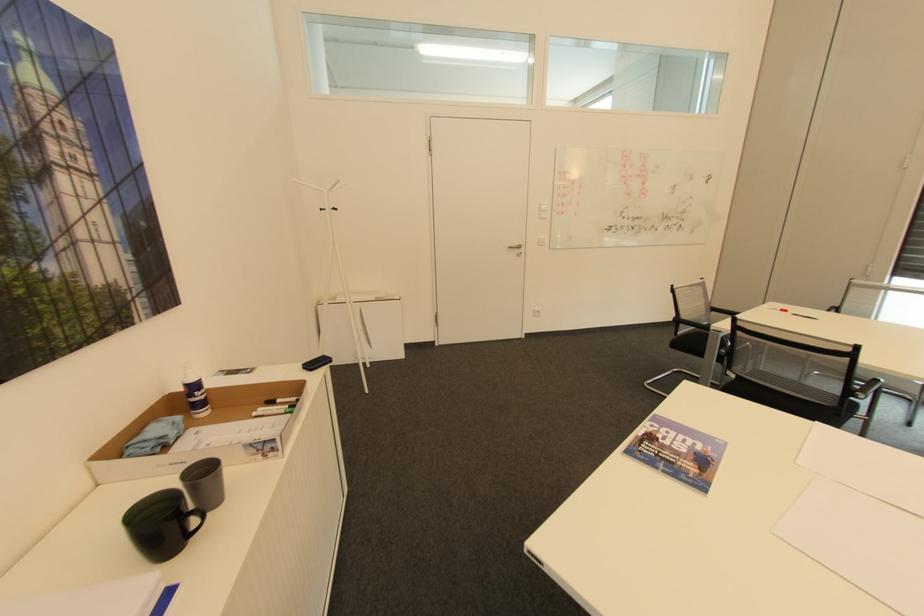
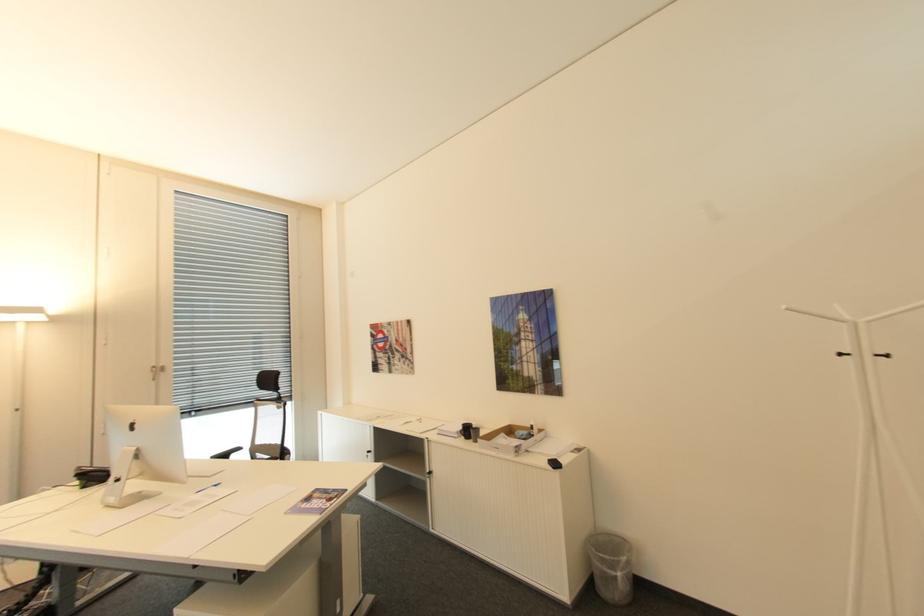
Locate, in the second image, the point that corresponds to point (342, 209) in the first image.

(894, 355)